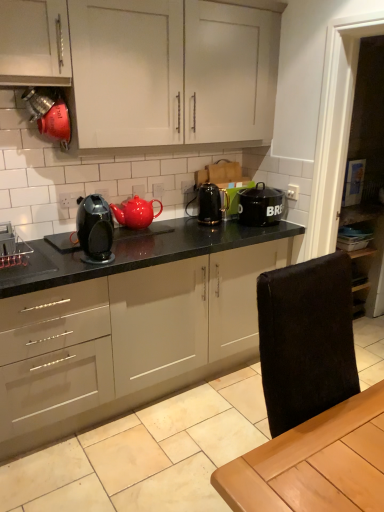
I want to click on free space underneath glossy ceramic teapot at center, the first kitchen appliance in the left-to-right sequence (from a real-world perspective), so click(x=136, y=229).